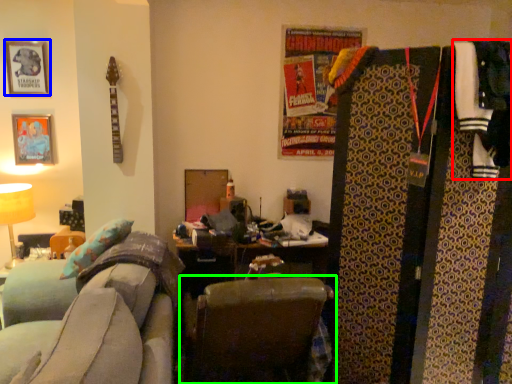
Question: Considering the real-world distances, which object is closest to clothing (highlighted by a red box)? picture frame (highlighted by a blue box) or chair (highlighted by a green box).

Choices:
 (A) picture frame
 (B) chair

Answer: (B)